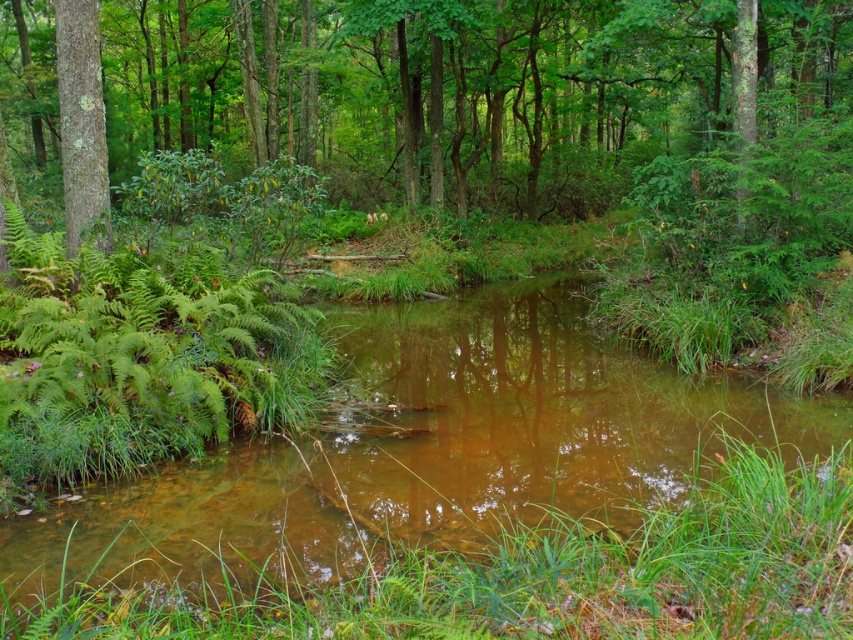
Question: Is green leafy tree at center further to the viewer compared to smooth bark tree at left?

Choices:
 (A) no
 (B) yes

Answer: (B)

Question: Is the position of clear water stream at center more distant than that of smooth bark tree at left?

Choices:
 (A) yes
 (B) no

Answer: (B)

Question: Which of these objects is positioned farthest from the smooth bark tree at left?

Choices:
 (A) clear water stream at center
 (B) green leafy tree at center

Answer: (B)

Question: Which point is farther to the camera?

Choices:
 (A) green leafy tree at center
 (B) clear water stream at center

Answer: (A)

Question: Among these objects, which one is nearest to the camera?

Choices:
 (A) green leafy tree at center
 (B) clear water stream at center
 (C) smooth bark tree at left

Answer: (B)

Question: Can you confirm if clear water stream at center is positioned below smooth bark tree at left?

Choices:
 (A) no
 (B) yes

Answer: (B)